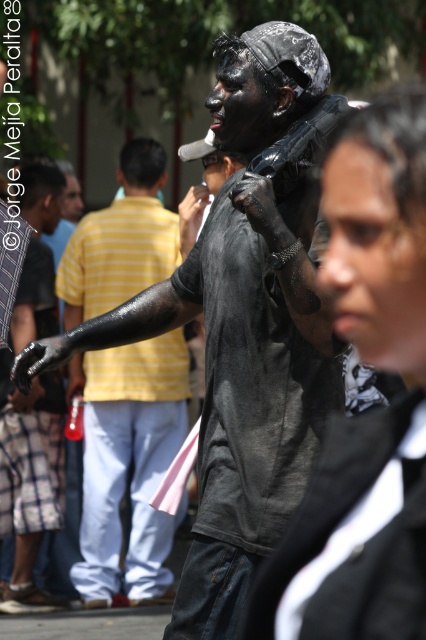
Who is shorter, matte black jacket at center or black matte body at center?

matte black jacket at center is shorter.

Between point (296, 525) and point (118, 264), which one is positioned behind?

Point (118, 264)

Where is `matte black jacket at center`? The height and width of the screenshot is (640, 426). matte black jacket at center is located at coordinates (365, 413).